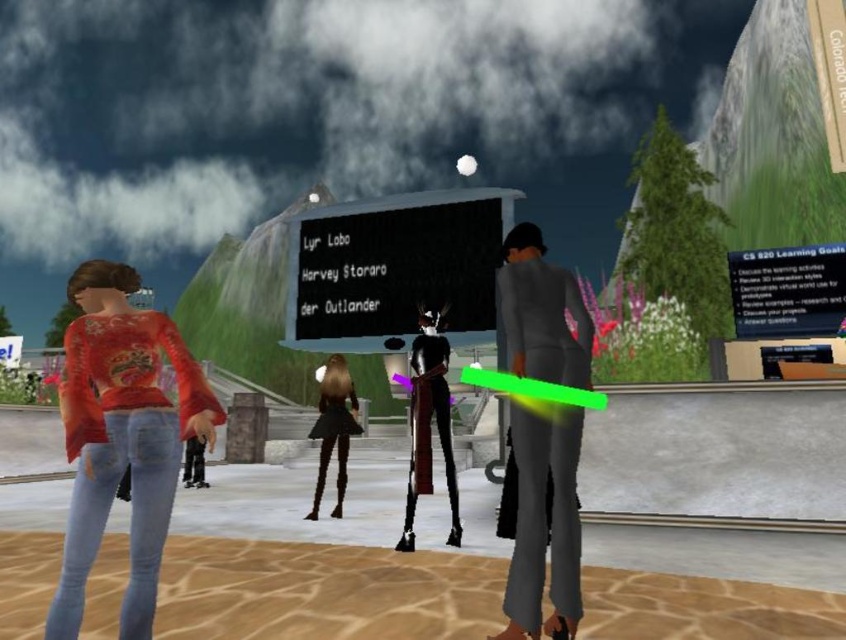
You are an avatar in the virtual environment and want to move from your current position to the point marked as point (343, 362). There is an obstacle at point (562, 508). Will you encounter this obstacle before reaching your destination?

Yes, you will encounter the obstacle at point (562, 508) before reaching the destination at point (343, 362) because point (562, 508) is in front of point (343, 362).

You are an avatar in this virtual environment and want to greet both the matte gray suit at center and the shiny black dress at center. Which avatar should you approach first based on their positions?

You should approach the matte gray suit at center first because it is closer to you than the shiny black dress at center.